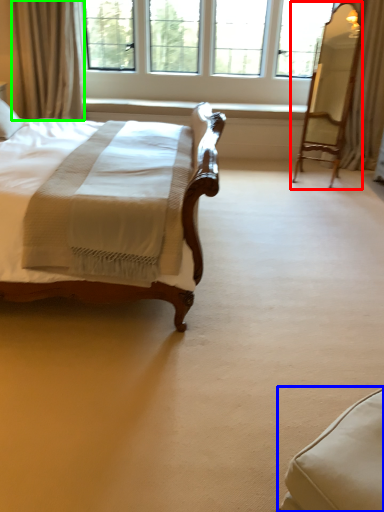
Question: Which is nearer to the swivel chair (highlighted by a red box)? swivel chair (highlighted by a blue box) or curtain (highlighted by a green box).

Choices:
 (A) swivel chair
 (B) curtain

Answer: (B)